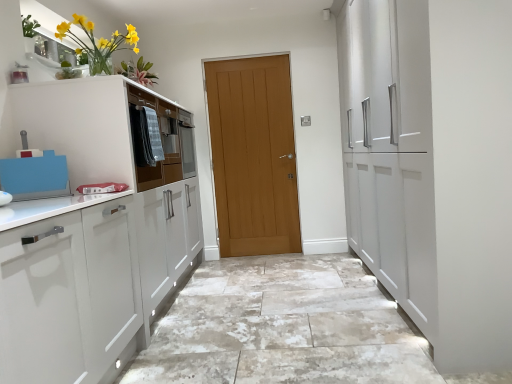
What is the approximate height of matte brown drawer at center?

matte brown drawer at center is 24.10 inches tall.

Where is `yellow glass vase at upper left`? yellow glass vase at upper left is located at coordinates (98, 42).

Where is `light brown wooden door at center`? This screenshot has height=384, width=512. light brown wooden door at center is located at coordinates (253, 155).

This screenshot has width=512, height=384. Identify the location of marble-like granite floor at center. coord(282,327).

Considering the positions of objects light brown wooden door at center and yellow glass vase at upper left in the image provided, who is behind, light brown wooden door at center or yellow glass vase at upper left?

light brown wooden door at center is further from the camera.

Looking at this image, considering the sizes of objects light brown wooden door at center and yellow glass vase at upper left in the image provided, who is shorter, light brown wooden door at center or yellow glass vase at upper left?

yellow glass vase at upper left is shorter.

This screenshot has width=512, height=384. Find the location of `floral arrangement above the light brown wooden door at center (from a real-world perspective)`. floral arrangement above the light brown wooden door at center (from a real-world perspective) is located at coordinates (98, 42).

Could you tell me if light brown wooden door at center is facing matte brown drawer at center?

No, light brown wooden door at center does not turn towards matte brown drawer at center.

From a real-world perspective, is light brown wooden door at center physically below matte brown drawer at center?

Yes, from a real-world perspective, light brown wooden door at center is below matte brown drawer at center.

Is point (255, 161) farther from viewer compared to point (151, 182)?

Yes.

In the scene shown: Between light brown wooden door at center and matte brown drawer at center, which one has larger width?

Wider between the two is matte brown drawer at center.

Which is more to the right, marble-like granite floor at center or matte brown drawer at center?

From the viewer's perspective, marble-like granite floor at center appears more on the right side.

Does marble-like granite floor at center come behind matte brown drawer at center?

No, the depth of marble-like granite floor at center is less than that of matte brown drawer at center.

You are a GUI agent. You are given a task and a screenshot of the screen. Output one action in this format:
    pyautogui.click(x=<x>, y=<y>)
    Task: Click on the granite located in front of the matte brown drawer at center
    The width and height of the screenshot is (512, 384).
    Given the screenshot: What is the action you would take?
    pyautogui.click(x=282, y=327)

Is marble-like granite floor at center far from light brown wooden door at center?

Yes, marble-like granite floor at center is far from light brown wooden door at center.

From the image's perspective, would you say marble-like granite floor at center is shown under light brown wooden door at center?

Yes, from the image's perspective, marble-like granite floor at center is beneath light brown wooden door at center.

Does marble-like granite floor at center have a lesser width compared to light brown wooden door at center?

In fact, marble-like granite floor at center might be wider than light brown wooden door at center.

Does marble-like granite floor at center contain light brown wooden door at center?

No, light brown wooden door at center is located outside of marble-like granite floor at center.

Looking at this image, from the image's perspective, which is above, marble-like granite floor at center or yellow glass vase at upper left?

yellow glass vase at upper left.

Does point (355, 331) come behind point (105, 56)?

No, it is not.

From the picture: Who is smaller, marble-like granite floor at center or yellow glass vase at upper left?

Smaller between the two is yellow glass vase at upper left.

Is matte brown drawer at center oriented away from light brown wooden door at center?

No, matte brown drawer at center is not facing the opposite direction of light brown wooden door at center.

Which object is wider, matte brown drawer at center or light brown wooden door at center?

matte brown drawer at center is wider.

Which of these two, matte brown drawer at center or light brown wooden door at center, is bigger?

light brown wooden door at center.

Considering the positions of objects matte brown drawer at center and light brown wooden door at center in the image provided, who is behind, matte brown drawer at center or light brown wooden door at center?

light brown wooden door at center is behind.

Is light brown wooden door at center turned away from marble-like granite floor at center?

No, marble-like granite floor at center is not at the back of light brown wooden door at center.

Measure the distance between light brown wooden door at center and marble-like granite floor at center.

light brown wooden door at center is 5.28 feet from marble-like granite floor at center.

Between light brown wooden door at center and marble-like granite floor at center, which one appears on the right side from the viewer's perspective?

From the viewer's perspective, marble-like granite floor at center appears more on the right side.

From the image's perspective, is light brown wooden door at center under marble-like granite floor at center?

No.

Where is `floral arrangement that appears on the left of light brown wooden door at center`? The image size is (512, 384). floral arrangement that appears on the left of light brown wooden door at center is located at coordinates (98, 42).

Find the location of a particular element. Image resolution: width=512 pixels, height=384 pixels. door below the matte brown drawer at center (from the image's perspective) is located at coordinates (253, 155).

When comparing their distances from marble-like granite floor at center, does light brown wooden door at center or yellow glass vase at upper left seem further?

Based on the image, yellow glass vase at upper left appears to be further to marble-like granite floor at center.

When comparing their distances from yellow glass vase at upper left, does light brown wooden door at center or matte brown drawer at center seem closer?

matte brown drawer at center.

When comparing their distances from matte brown drawer at center, does light brown wooden door at center or yellow glass vase at upper left seem closer?

Based on the image, yellow glass vase at upper left appears to be nearer to matte brown drawer at center.

From the image, which object appears to be farther from marble-like granite floor at center, light brown wooden door at center or matte brown drawer at center?

Based on the image, light brown wooden door at center appears to be further to marble-like granite floor at center.

Considering their positions, is matte brown drawer at center positioned further to yellow glass vase at upper left than marble-like granite floor at center?

marble-like granite floor at center is further to yellow glass vase at upper left.

Considering their positions, is matte brown drawer at center positioned further to yellow glass vase at upper left than light brown wooden door at center?

The object further to yellow glass vase at upper left is light brown wooden door at center.

Estimate the real-world distances between objects in this image. Which object is further from matte brown drawer at center, marble-like granite floor at center or yellow glass vase at upper left?

marble-like granite floor at center is positioned further to the anchor matte brown drawer at center.

Looking at this image, estimate the real-world distances between objects in this image. Which object is closer to light brown wooden door at center, marble-like granite floor at center or matte brown drawer at center?

matte brown drawer at center lies closer to light brown wooden door at center than the other object.

At what (x,y) coordinates should I click in order to perform the action: click on floral arrangement positioned between marble-like granite floor at center and matte brown drawer at center from near to far. Please return your answer as a coordinate pair (x, y). Looking at the image, I should click on (98, 42).

You are a GUI agent. You are given a task and a screenshot of the screen. Output one action in this format:
    pyautogui.click(x=<x>, y=<y>)
    Task: Click on the drawer positioned between marble-like granite floor at center and light brown wooden door at center from near to far
    Image resolution: width=512 pixels, height=384 pixels.
    Given the screenshot: What is the action you would take?
    pyautogui.click(x=160, y=140)

Identify the location of floral arrangement positioned between marble-like granite floor at center and light brown wooden door at center from near to far. This screenshot has width=512, height=384. (98, 42).

This screenshot has height=384, width=512. Identify the location of drawer located between yellow glass vase at upper left and light brown wooden door at center in the depth direction. (160, 140).